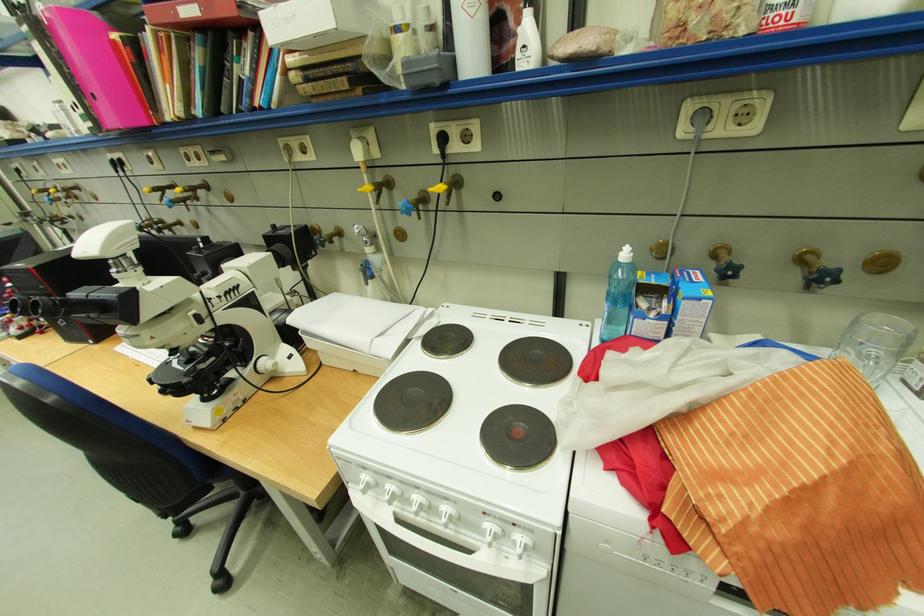
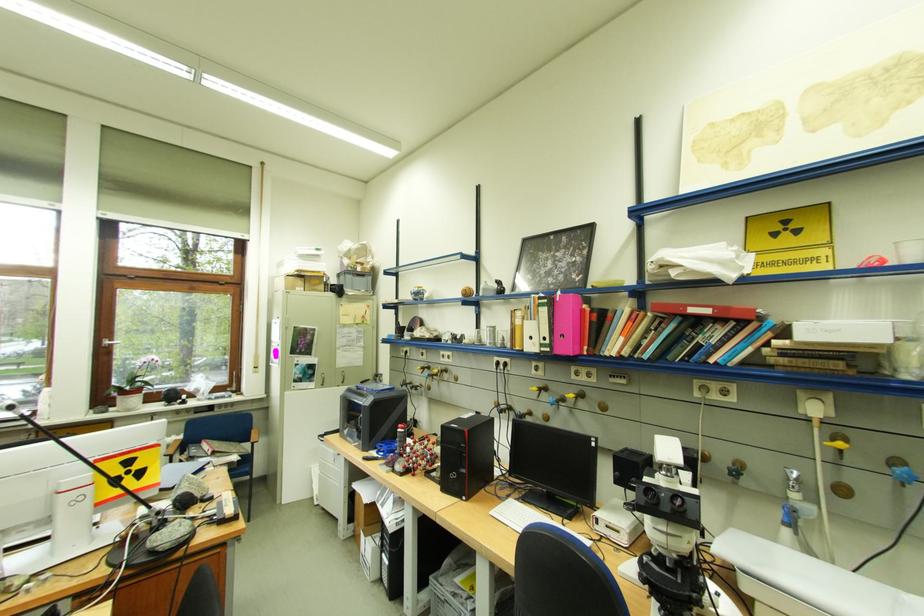
Question: I am providing you with two images of the same scene from different viewpoints. After the viewpoint changes to image2, which objects are now occluded?

Choices:
 (A) white cardboard box
 (B) silver window handle
 (C) molecular model
 (D) none of these

Answer: (D)